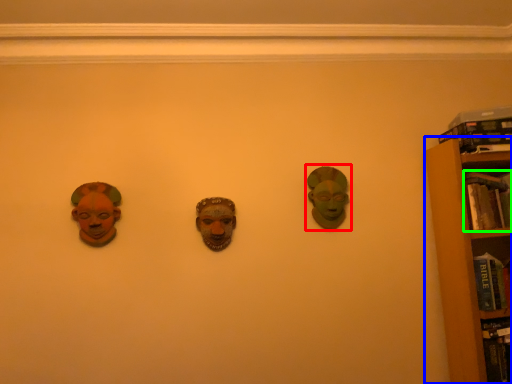
Question: Which object is positioned farthest from head (highlighted by a red box)? Select from bookcase (highlighted by a blue box) and book (highlighted by a green box).

Choices:
 (A) bookcase
 (B) book

Answer: (B)